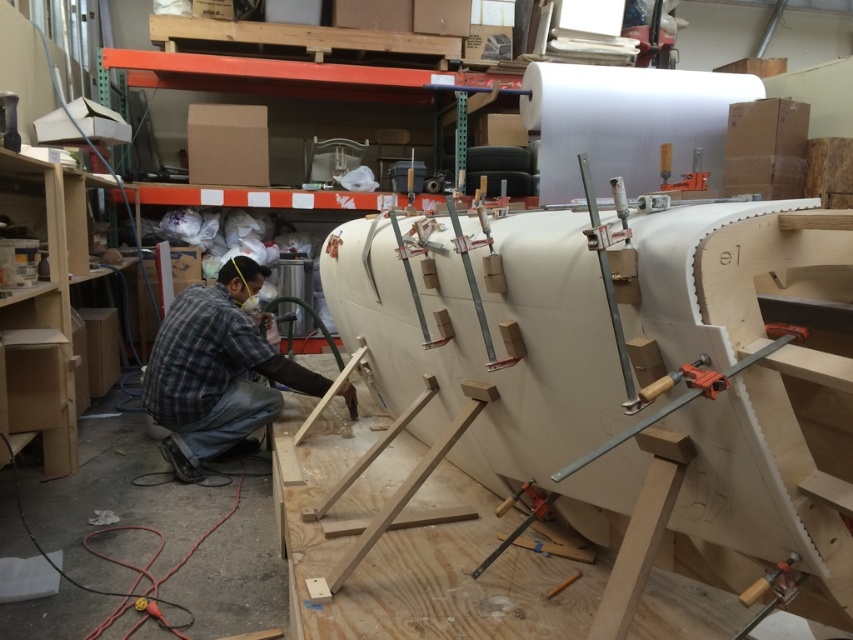
You are standing at the position of the camera in the workshop. There is a plaid fabric shirt at lower left that you need to grab. Can you reach it without moving your feet? Assume your arm can extend 1.5 meters.

The plaid fabric shirt at lower left and camera are 2.76 meters apart. Since your arm can only extend 1.5 meters, you cannot reach the plaid fabric shirt at lower left without moving your feet.

You are an assistant in the workshop and need to identify which item is bigger between the plaid fabric shirt at lower left and the metallic clamp at upper right. Can you determine which one is larger?

The plaid fabric shirt at lower left is larger in size than the metallic clamp at upper right, so the plaid fabric shirt at lower left is bigger.